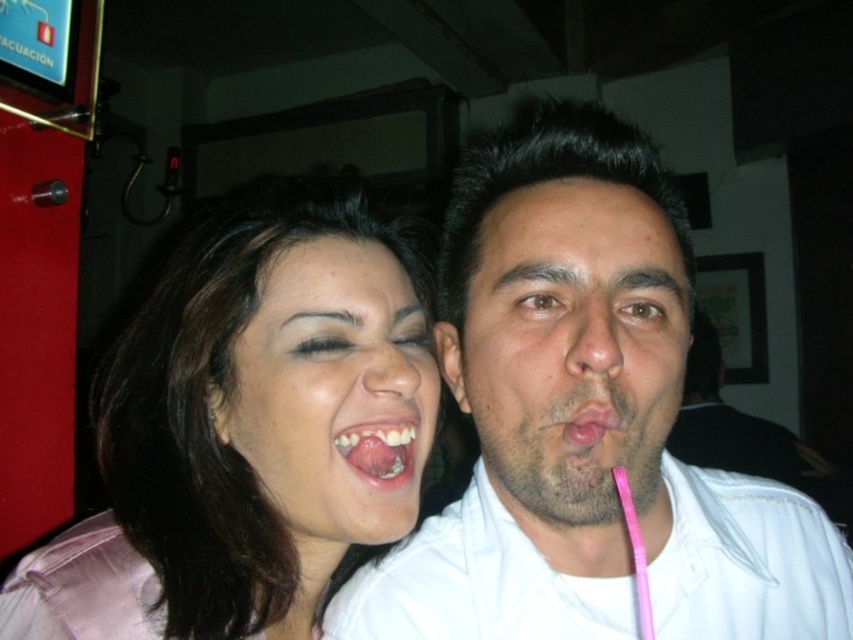
Question: Which of these objects is positioned closest to the satin pink blouse at upper left?

Choices:
 (A) smooth skin face at center
 (B) pink matte tongue at center

Answer: (A)

Question: Can you confirm if pink plastic straw at center is smaller than pink glossy tongue at center?

Choices:
 (A) yes
 (B) no

Answer: (B)

Question: Which object is closer to the camera taking this photo?

Choices:
 (A) satin pink blouse at upper left
 (B) pink plastic straw at center
 (C) smooth skin face at center
 (D) pink glossy tongue at center

Answer: (B)

Question: Which of the following is the farthest from the observer?

Choices:
 (A) pink plastic straw at center
 (B) white matte shirt at center

Answer: (B)

Question: Does satin pink blouse at upper left appear on the right side of pink plastic straw at center?

Choices:
 (A) yes
 (B) no

Answer: (B)

Question: Can you confirm if smooth skin face at center is positioned above pink matte tongue at center?

Choices:
 (A) no
 (B) yes

Answer: (A)